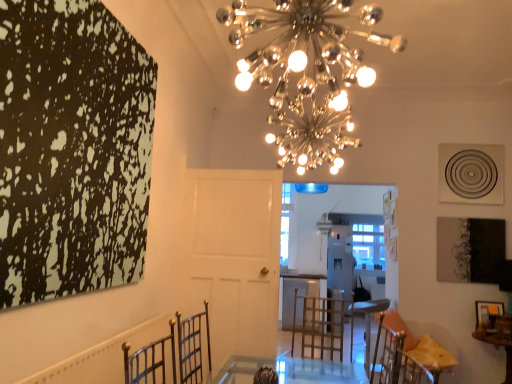
Describe the element at coordinates (487, 311) in the screenshot. This screenshot has height=384, width=512. I see `wooden picture frame at lower right` at that location.

This screenshot has height=384, width=512. Find the location of `wooden table at lower right`. wooden table at lower right is located at coordinates (x=497, y=345).

Locate an element on the screen. Image resolution: width=512 pixels, height=384 pixels. metallic spherical lights at upper center is located at coordinates (307, 72).

The height and width of the screenshot is (384, 512). I want to click on metallic gold chair at lower right, so click(x=420, y=346).

Is wooden picture frame at lower right taller or shorter than metallic gold chair at lower right?

wooden picture frame at lower right is shorter than metallic gold chair at lower right.

Is wooden picture frame at lower right next to metallic gold chair at lower right?

There is a gap between wooden picture frame at lower right and metallic gold chair at lower right.

From a real-world perspective, is wooden picture frame at lower right over metallic gold chair at lower right?

Indeed, from a real-world perspective, wooden picture frame at lower right stands above metallic gold chair at lower right.

Which object is positioned more to the right, wooden picture frame at lower right or metallic gold chair at lower right?

wooden picture frame at lower right is more to the right.

In the image, is metallic spherical lights at upper center positioned in front of or behind wooden table at lower right?

Visually, metallic spherical lights at upper center is located in front of wooden table at lower right.

Looking at this image, is metallic spherical lights at upper center not close to wooden table at lower right?

Yes.

From a real-world perspective, is metallic spherical lights at upper center below wooden table at lower right?

Actually, metallic spherical lights at upper center is physically above wooden table at lower right in the real world.

In terms of height, does metallic spherical lights at upper center look taller or shorter compared to wooden table at lower right?

In the image, metallic spherical lights at upper center appears to be taller than wooden table at lower right.

Is metallic gold chair at lower right at the right side of metallic spherical lights at upper center?

Yes, metallic gold chair at lower right is to the right of metallic spherical lights at upper center.

Is metallic gold chair at lower right positioned behind metallic spherical lights at upper center?

Yes, metallic gold chair at lower right is behind metallic spherical lights at upper center.

From the image's perspective, would you say metallic gold chair at lower right is positioned over metallic spherical lights at upper center?

No, from the image's perspective, metallic gold chair at lower right is not above metallic spherical lights at upper center.

Is wooden picture frame at lower right outside of metallic spherical lights at upper center?

That's correct, wooden picture frame at lower right is outside of metallic spherical lights at upper center.

Between wooden picture frame at lower right and metallic spherical lights at upper center, which one has smaller width?

wooden picture frame at lower right.

In the scene shown: Can you confirm if wooden picture frame at lower right is shorter than metallic spherical lights at upper center?

Indeed, wooden picture frame at lower right has a lesser height compared to metallic spherical lights at upper center.

In the scene shown: Can you see wooden picture frame at lower right touching metallic spherical lights at upper center?

No, wooden picture frame at lower right is not making contact with metallic spherical lights at upper center.

From the image's perspective, which one is positioned higher, metallic spherical lights at upper center or metallic gold chair at lower right?

metallic spherical lights at upper center, from the image's perspective.

Which object is closer to the camera taking this photo, metallic spherical lights at upper center or metallic gold chair at lower right?

metallic spherical lights at upper center is in front.

Is metallic gold chair at lower right not near wooden table at lower right?

They are positioned close to each other.

Could you tell me if metallic gold chair at lower right is turned towards wooden table at lower right?

No, metallic gold chair at lower right does not turn towards wooden table at lower right.

Who is smaller, metallic gold chair at lower right or wooden table at lower right?

Smaller between the two is wooden table at lower right.

Which object is further away from the camera taking this photo, metallic gold chair at lower right or wooden table at lower right?

metallic gold chair at lower right is further away from the camera.

Is wooden table at lower right located outside wooden picture frame at lower right?

Yes, wooden table at lower right is located beyond the bounds of wooden picture frame at lower right.

From a real-world perspective, which is physically above, wooden table at lower right or wooden picture frame at lower right?

In real-world perspective, wooden picture frame at lower right is above.

How far apart are wooden table at lower right and wooden picture frame at lower right?

wooden table at lower right and wooden picture frame at lower right are 9.70 inches apart.

The height and width of the screenshot is (384, 512). I want to click on furniture that is on the left side of wooden picture frame at lower right, so (x=420, y=346).

I want to click on table on the right side of metallic spherical lights at upper center, so click(497, 345).

Considering their positions, is wooden table at lower right positioned further to wooden picture frame at lower right than metallic gold chair at lower right?

Based on the image, metallic gold chair at lower right appears to be further to wooden picture frame at lower right.

Considering their positions, is metallic spherical lights at upper center positioned further to wooden table at lower right than metallic gold chair at lower right?

metallic spherical lights at upper center is further to wooden table at lower right.

From the picture: From the image, which object appears to be farther from metallic spherical lights at upper center, wooden picture frame at lower right or metallic gold chair at lower right?

Among the two, wooden picture frame at lower right is located further to metallic spherical lights at upper center.

Which object lies further to the anchor point wooden picture frame at lower right, metallic gold chair at lower right or wooden table at lower right?

metallic gold chair at lower right lies further to wooden picture frame at lower right than the other object.

Considering their positions, is metallic spherical lights at upper center positioned further to wooden picture frame at lower right than metallic gold chair at lower right?

The object further to wooden picture frame at lower right is metallic spherical lights at upper center.

From the image, which object appears to be farther from metallic spherical lights at upper center, metallic gold chair at lower right or wooden table at lower right?

wooden table at lower right is positioned further to the anchor metallic spherical lights at upper center.

Looking at the image, which one is located further to wooden picture frame at lower right, metallic gold chair at lower right or metallic spherical lights at upper center?

metallic spherical lights at upper center is positioned further to the anchor wooden picture frame at lower right.

Estimate the real-world distances between objects in this image. Which object is closer to metallic gold chair at lower right, wooden picture frame at lower right or metallic spherical lights at upper center?

wooden picture frame at lower right.

Locate an element on the screen. picture frame between metallic spherical lights at upper center and wooden table at lower right in the vertical direction is located at coordinates (487, 311).

At what (x,y) coordinates should I click in order to perform the action: click on table between metallic gold chair at lower right and wooden picture frame at lower right. Please return your answer as a coordinate pair (x, y). This screenshot has width=512, height=384. Looking at the image, I should click on (497, 345).

This screenshot has height=384, width=512. What are the coordinates of `furniture between metallic spherical lights at upper center and wooden table at lower right in the vertical direction` in the screenshot? It's located at (420, 346).

In order to click on picture frame between metallic spherical lights at upper center and metallic gold chair at lower right from top to bottom in this screenshot , I will do `click(487, 311)`.